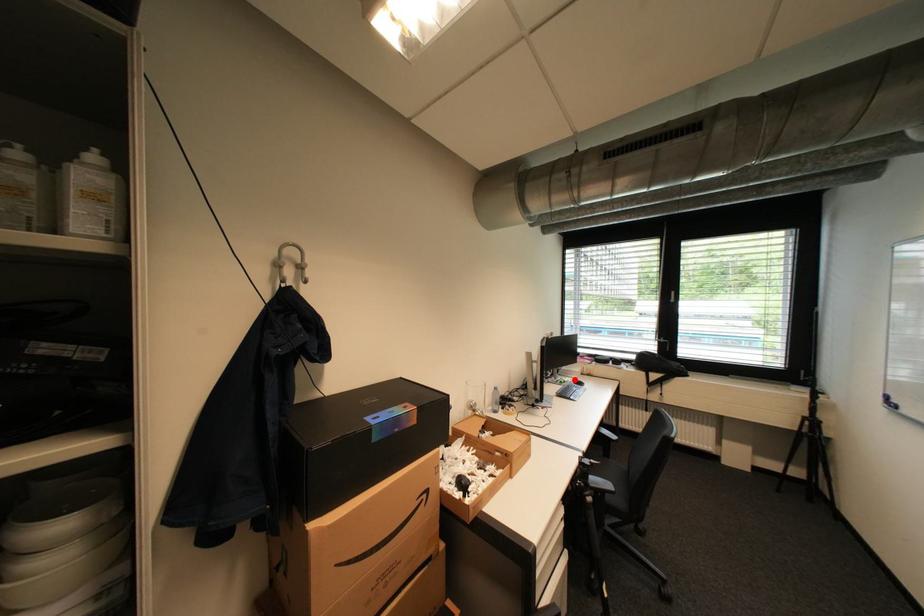
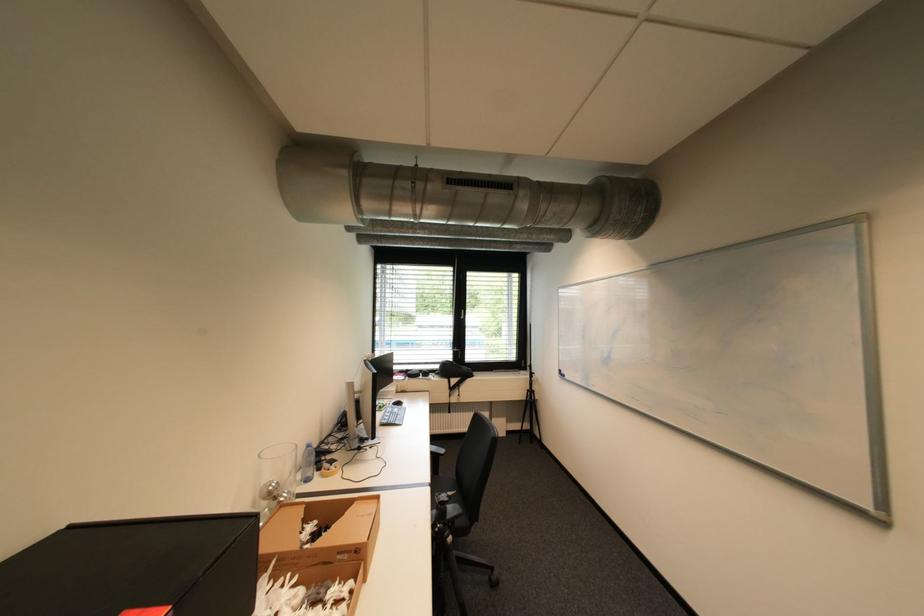
Where in the second image is the point corresponding to the highlighted location from the first image?

(393, 403)